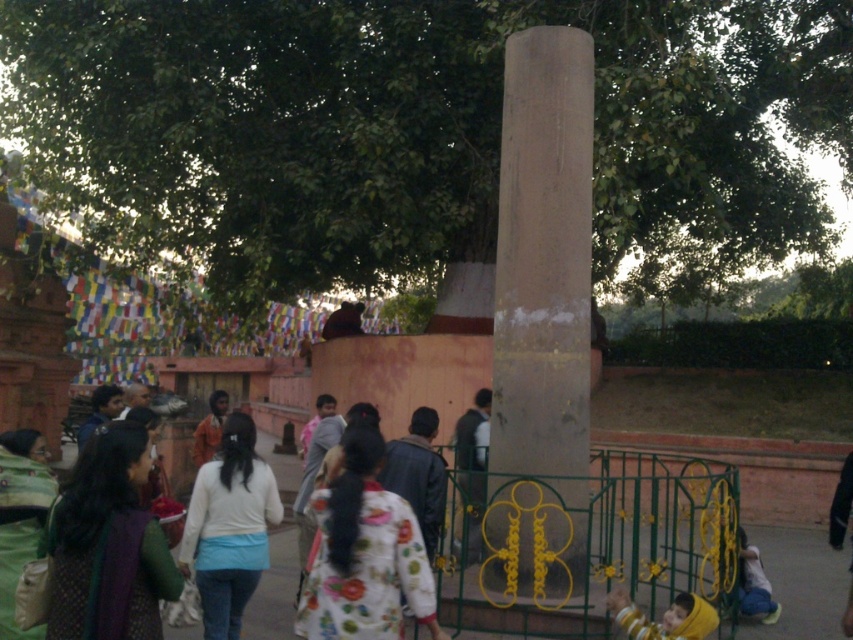
Question: Can you confirm if white matte shirt at center is positioned to the right of silky black hair at center?

Choices:
 (A) yes
 (B) no

Answer: (A)

Question: Which object appears closest to the camera in this image?

Choices:
 (A) smooth stone pillar at center
 (B) white matte shirt at center
 (C) yellow fabric headscarf at lower right
 (D) floral-patterned fabric at center

Answer: (D)

Question: Which object appears farthest from the camera in this image?

Choices:
 (A) white matte shirt at center
 (B) silky black hair at center
 (C) floral-patterned fabric at center
 (D) smooth stone pillar at center

Answer: (B)

Question: Considering the relative positions of white matte shirt at center and orange fabric shirt at center in the image provided, where is white matte shirt at center located with respect to orange fabric shirt at center?

Choices:
 (A) left
 (B) right

Answer: (B)

Question: Can you confirm if green textured dress at center is wider than yellow fabric headscarf at lower right?

Choices:
 (A) no
 (B) yes

Answer: (A)

Question: Which point is farther to the camera?

Choices:
 (A) smooth stone pillar at center
 (B) silky black hair at center
 (C) floral-patterned fabric at center

Answer: (B)